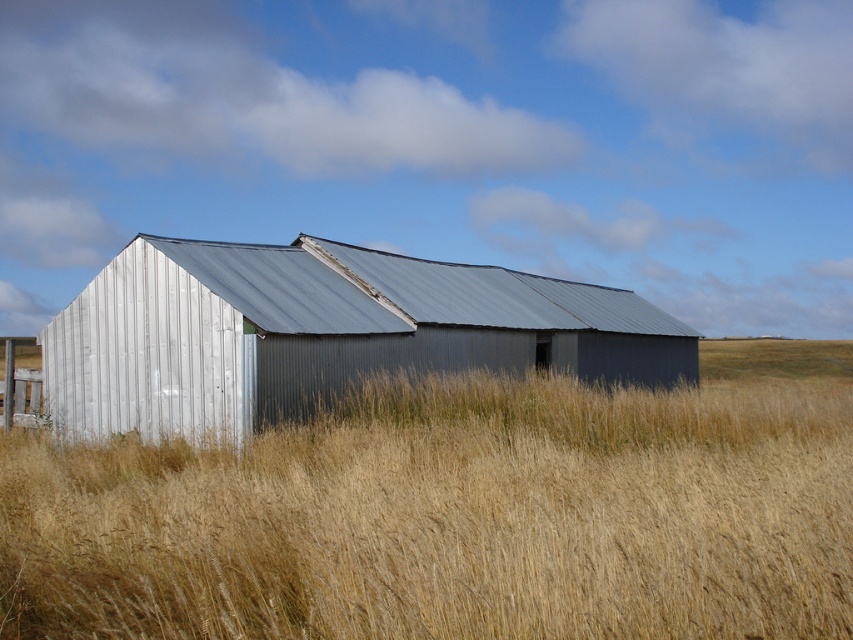
Looking at this image, who is positioned more to the right, golden dry grass at center or metallic silver barn at center?

Positioned to the right is golden dry grass at center.

Between golden dry grass at center and metallic silver barn at center, which one has more height?

With more height is metallic silver barn at center.

Which is behind, point (531, 552) or point (532, 339)?

The point (532, 339) is more distant.

At what (x,y) coordinates should I click in order to perform the action: click on golden dry grass at center. Please return your answer as a coordinate pair (x, y). Looking at the image, I should click on (459, 513).